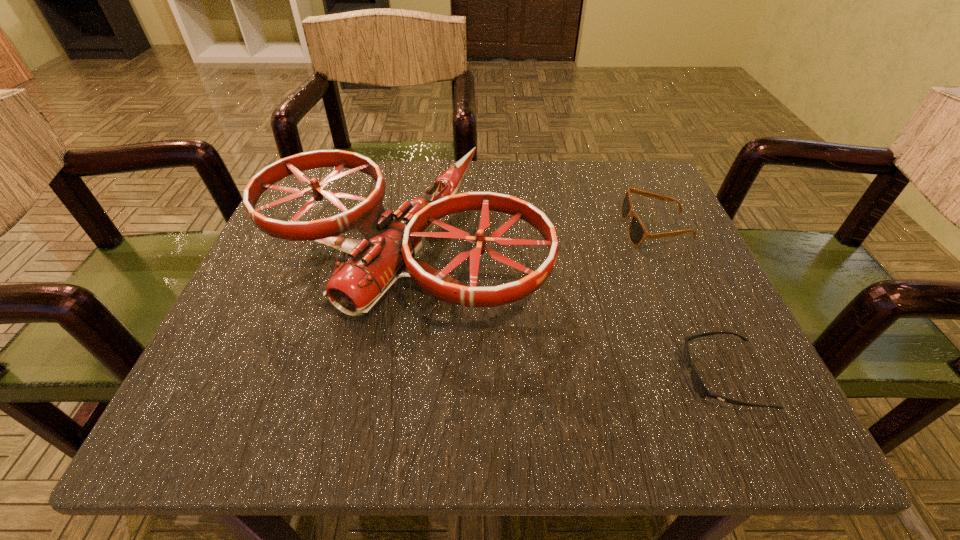
Find the location of a particular element. Image resolution: width=960 pixels, height=540 pixels. blank area located on the front-facing side of the shortest object is located at coordinates (399, 376).

Locate an element on the screen. The height and width of the screenshot is (540, 960). free location located on the front-facing side of the shortest object is located at coordinates (509, 376).

Where is `vacant space located 0.140m on the front-facing side of the shortest object`? vacant space located 0.140m on the front-facing side of the shortest object is located at coordinates (583, 376).

Find the location of a particular element. The width and height of the screenshot is (960, 540). drone that is at the far edge is located at coordinates (356, 286).

Image resolution: width=960 pixels, height=540 pixels. Identify the location of sunglasses that is at the far edge. (637, 232).

At what (x,y) coordinates should I click in order to perform the action: click on object present at the near edge. Please return your answer as a coordinate pair (x, y). The image size is (960, 540). Looking at the image, I should click on (700, 388).

Where is `object at the left edge`? The height and width of the screenshot is (540, 960). object at the left edge is located at coordinates (356, 286).

Find the location of `object situated at the far left corner`. object situated at the far left corner is located at coordinates (356, 286).

Where is `object situated at the far right corner`? object situated at the far right corner is located at coordinates (637, 232).

Identify the location of object that is positioned at the near right corner. (700, 388).